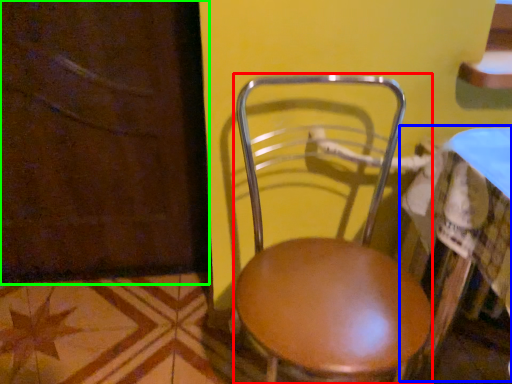
Question: Which object is positioned farthest from chair (highlighted by a red box)? Select from table (highlighted by a blue box) and screen door (highlighted by a green box).

Choices:
 (A) table
 (B) screen door

Answer: (B)